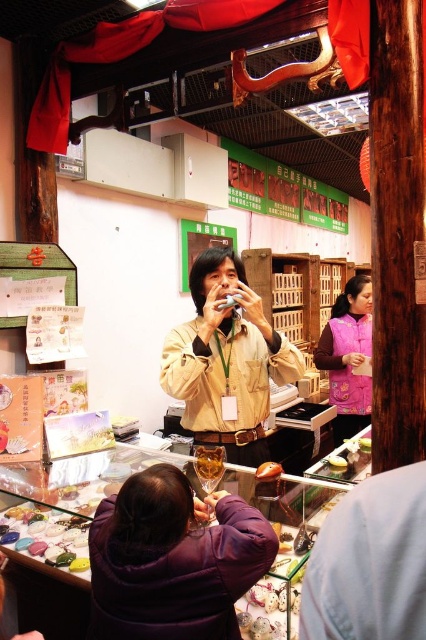
Question: Is tan leather jacket at center below pink fleece vest at center?

Choices:
 (A) yes
 (B) no

Answer: (B)

Question: Which point is farther from the camera taking this photo?

Choices:
 (A) (273, 464)
 (B) (351, 422)
 (C) (203, 483)
 (D) (196, 268)

Answer: (B)

Question: Is purple fuzzy coat at lower center below tan leather jacket at center?

Choices:
 (A) no
 (B) yes

Answer: (B)

Question: Is purple fuzzy coat at lower center bigger than pink fleece vest at center?

Choices:
 (A) yes
 (B) no

Answer: (B)

Question: Which point is closer to the camera?

Choices:
 (A) tan leather jacket at center
 (B) translucent glass at center
 (C) pink fleece vest at center

Answer: (B)

Question: Among these objects, which one is nearest to the camera?

Choices:
 (A) purple fuzzy coat at lower center
 (B) yellow matte cake at center
 (C) tan leather jacket at center
 (D) pink fleece vest at center

Answer: (A)